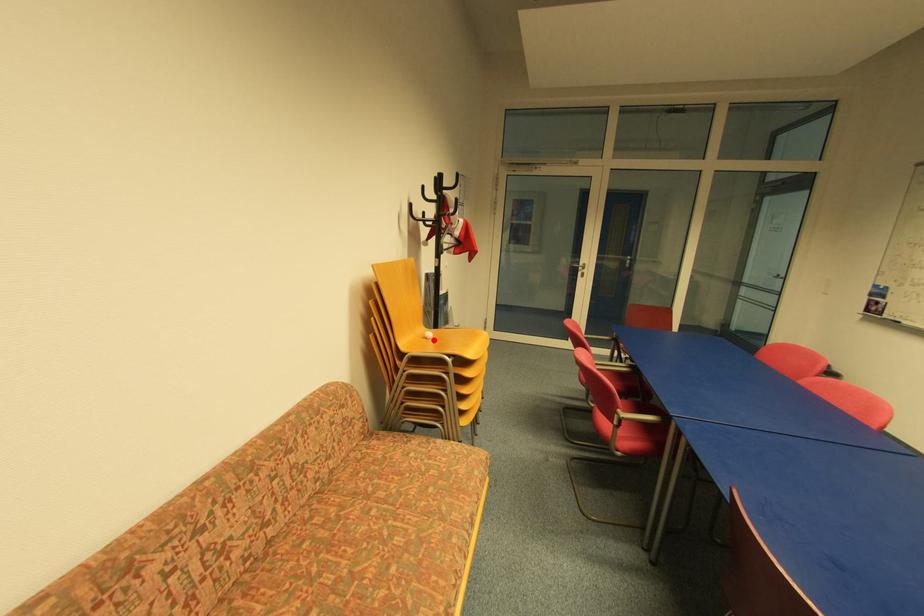
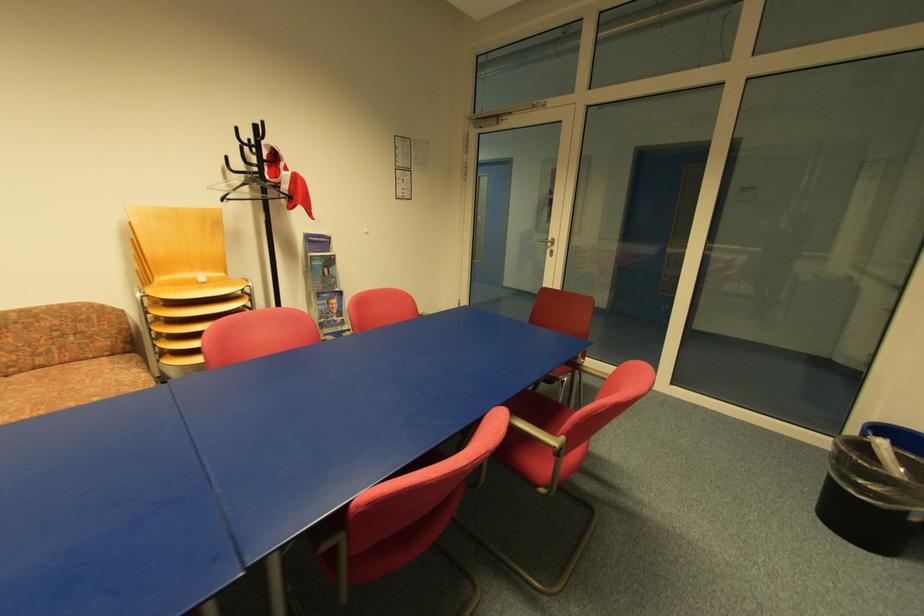
Find the pixel in the second image that matches the highlighted location in the first image.

(207, 285)